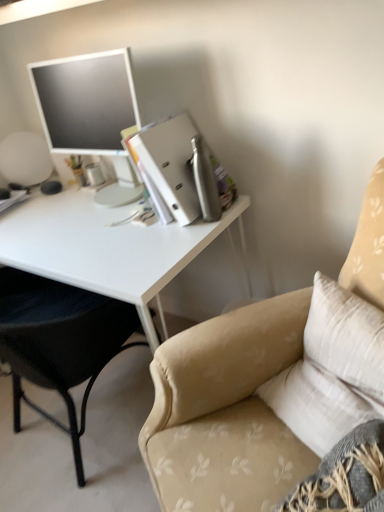
Where is `space that is in front of matte silver monitor at upper left`? space that is in front of matte silver monitor at upper left is located at coordinates (122, 223).